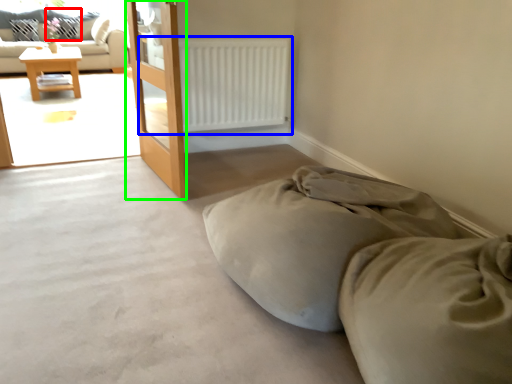
Question: Considering the real-world distances, which object is farthest from pillow (highlighted by a red box)? radiator (highlighted by a blue box) or screen door (highlighted by a green box)?

Choices:
 (A) radiator
 (B) screen door

Answer: (B)